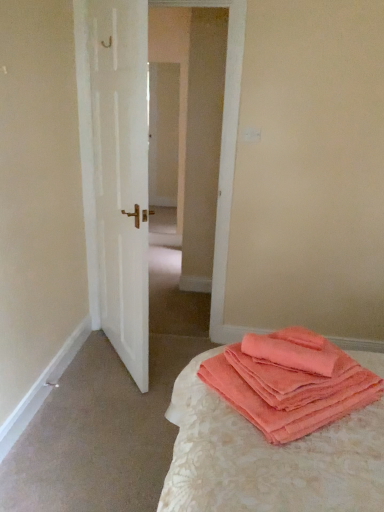
Question: Is coral fleece towels at lower right at the back of coral terry cloth towels at lower right?

Choices:
 (A) no
 (B) yes

Answer: (A)

Question: From the image's perspective, is coral terry cloth towels at lower right beneath coral fleece towels at lower right?

Choices:
 (A) no
 (B) yes

Answer: (B)

Question: Is coral terry cloth towels at lower right positioned far away from coral fleece towels at lower right?

Choices:
 (A) yes
 (B) no

Answer: (B)

Question: Does coral terry cloth towels at lower right appear on the left side of coral fleece towels at lower right?

Choices:
 (A) yes
 (B) no

Answer: (B)

Question: Considering the relative sizes of coral terry cloth towels at lower right and coral fleece towels at lower right in the image provided, is coral terry cloth towels at lower right wider than coral fleece towels at lower right?

Choices:
 (A) no
 (B) yes

Answer: (B)

Question: Could you tell me if coral terry cloth towels at lower right is turned towards coral fleece towels at lower right?

Choices:
 (A) no
 (B) yes

Answer: (A)

Question: Is the depth of coral fleece towels at lower right greater than that of white matte door at left?

Choices:
 (A) yes
 (B) no

Answer: (B)

Question: Can you confirm if coral fleece towels at lower right is bigger than white matte door at left?

Choices:
 (A) yes
 (B) no

Answer: (B)

Question: From a real-world perspective, is coral fleece towels at lower right located higher than white matte door at left?

Choices:
 (A) yes
 (B) no

Answer: (B)

Question: Is coral fleece towels at lower right at the right side of white matte door at left?

Choices:
 (A) no
 (B) yes

Answer: (B)

Question: Is coral fleece towels at lower right shorter than white matte door at left?

Choices:
 (A) yes
 (B) no

Answer: (A)

Question: Is coral fleece towels at lower right wider than white matte door at left?

Choices:
 (A) yes
 (B) no

Answer: (A)

Question: Considering the relative positions of white matte door at left and coral fleece towels at lower right in the image provided, is white matte door at left to the left of coral fleece towels at lower right from the viewer's perspective?

Choices:
 (A) yes
 (B) no

Answer: (A)